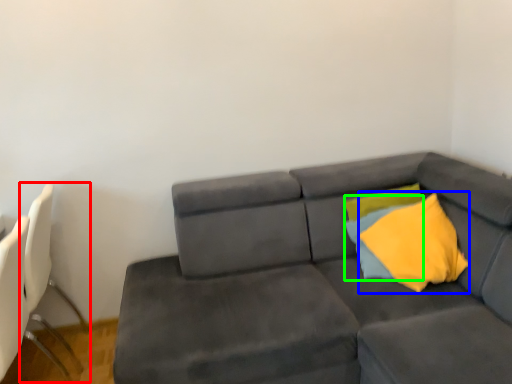
Question: Which is farther away from swivel chair (highlighted by a red box)? throw pillow (highlighted by a blue box) or pillow (highlighted by a green box)?

Choices:
 (A) throw pillow
 (B) pillow

Answer: (A)